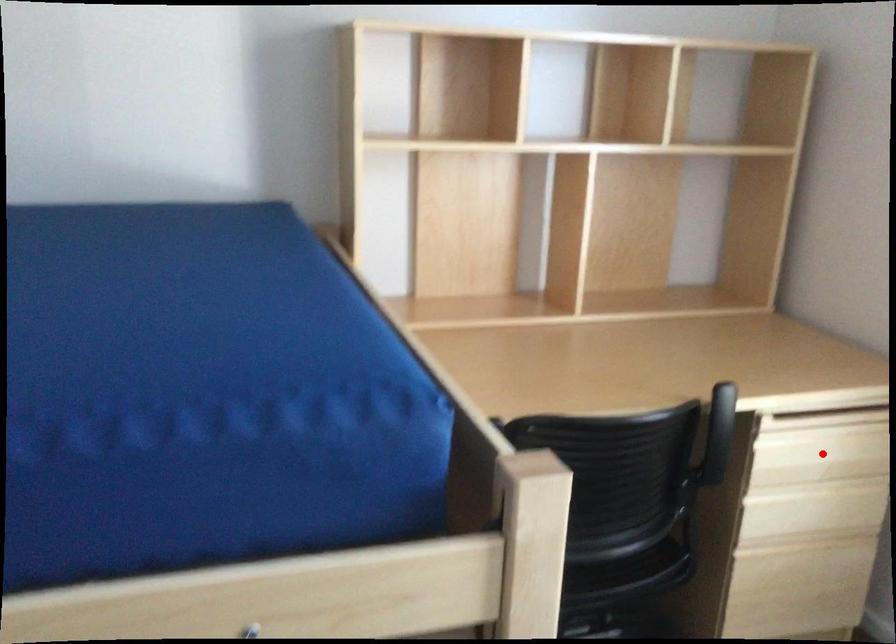
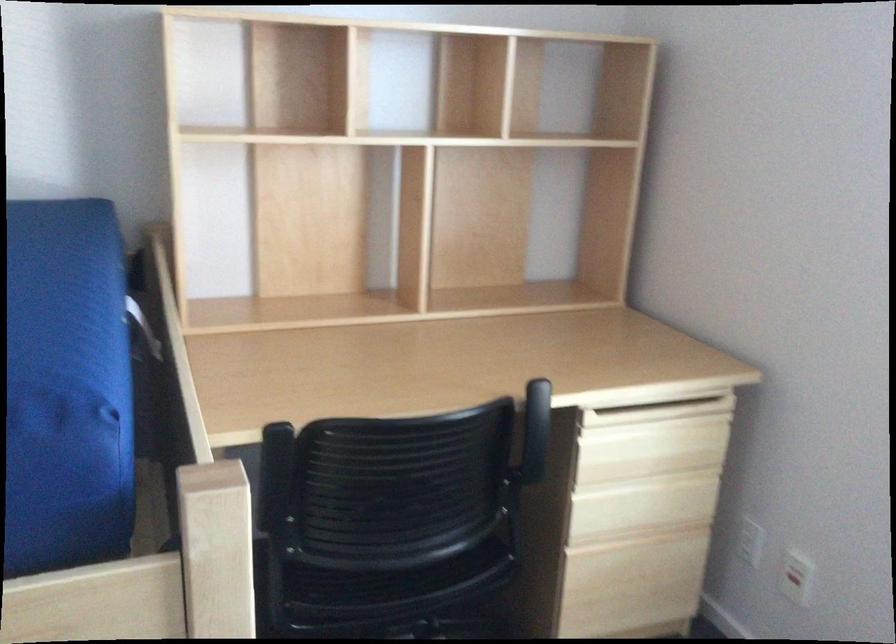
Find the pixel in the second image that matches the highlighted location in the first image.

(650, 448)